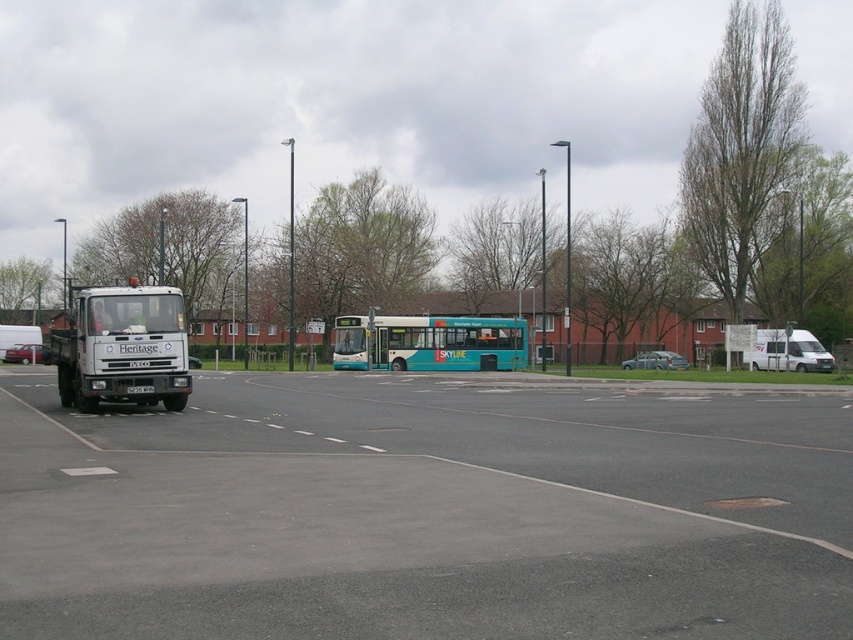
You are standing at the bus station and want to take a photo of the two points mentioned. Which point, point (193, 436) or point (660, 365), will appear larger in your camera view?

Point (193, 436) is closer to the camera than point (660, 365), so it will appear larger in the photo.

You are standing at the bus station and want to determine which of the two points, point [138,388] or point [799,371], is nearer to you. Based on the scene, which point is closer?

Point [138,388] is closer to the viewer than point [799,371].

Looking at this image, you are standing at the edge of the gray asphalt parking lot at lower left and want to walk to the metallic silver car at center. Is the parking lot shorter than the car? Please explain why.

The gray asphalt parking lot at lower left is shorter than the metallic silver car at center, so yes, the parking lot is shorter than the car because the description states that the parking lot is shorter in length compared to the car.